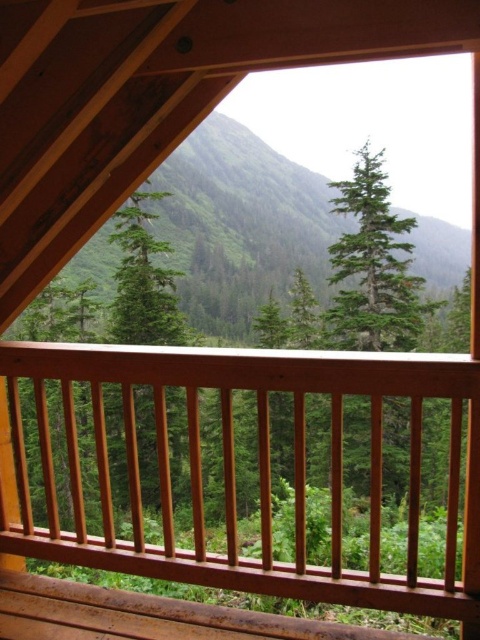
Question: Considering the relative positions of green textured mountain at upper center and green matte tree at center in the image provided, where is green textured mountain at upper center located with respect to green matte tree at center?

Choices:
 (A) below
 (B) above

Answer: (B)

Question: Observing the image, what is the correct spatial positioning of smooth wood railing at center in reference to green matte tree at center?

Choices:
 (A) left
 (B) right

Answer: (B)

Question: Which point is farther from the camera taking this photo?

Choices:
 (A) (224, 388)
 (B) (144, 205)
 (C) (213, 237)

Answer: (C)

Question: Considering the real-world distances, which object is farthest from the smooth wood railing at center?

Choices:
 (A) green matte tree at center
 (B) green textured mountain at upper center

Answer: (B)

Question: Which object is the closest to the smooth wood railing at center?

Choices:
 (A) green matte tree at center
 (B) green textured mountain at upper center

Answer: (A)

Question: Is smooth wood railing at center positioned at the back of green textured mountain at upper center?

Choices:
 (A) no
 (B) yes

Answer: (A)